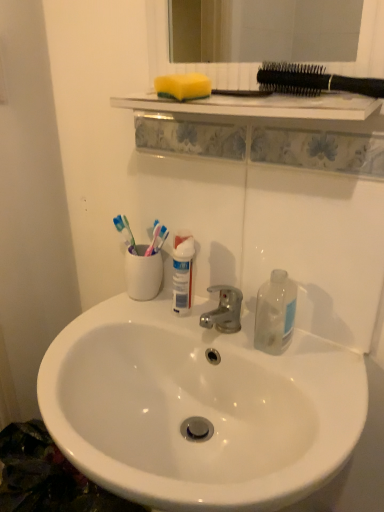
Question: Is yellow sponge at upper center to the right of white ceramic toothbrush holder at center from the viewer's perspective?

Choices:
 (A) yes
 (B) no

Answer: (A)

Question: Is white ceramic toothbrush holder at center at the back of yellow sponge at upper center?

Choices:
 (A) no
 (B) yes

Answer: (A)

Question: Is yellow sponge at upper center with white ceramic toothbrush holder at center?

Choices:
 (A) yes
 (B) no

Answer: (B)

Question: Does yellow sponge at upper center have a smaller size compared to white ceramic toothbrush holder at center?

Choices:
 (A) no
 (B) yes

Answer: (B)

Question: From the image's perspective, would you say yellow sponge at upper center is positioned over white ceramic toothbrush holder at center?

Choices:
 (A) no
 (B) yes

Answer: (B)

Question: Do you think white ceramic toothbrush holder at center is within white glossy sink at center, or outside of it?

Choices:
 (A) outside
 (B) inside

Answer: (A)

Question: Is white ceramic toothbrush holder at center in front of or behind white glossy sink at center in the image?

Choices:
 (A) behind
 (B) front

Answer: (A)

Question: From a real-world perspective, relative to white glossy sink at center, is white ceramic toothbrush holder at center vertically above or below?

Choices:
 (A) above
 (B) below

Answer: (A)

Question: Considering the positions of white ceramic toothbrush holder at center and white glossy sink at center in the image, is white ceramic toothbrush holder at center taller or shorter than white glossy sink at center?

Choices:
 (A) tall
 (B) short

Answer: (B)

Question: From a real-world perspective, is white ceramic toothbrush holder at center positioned above or below transparent plastic bottle at right?

Choices:
 (A) above
 (B) below

Answer: (A)

Question: Choose the correct answer: Is white ceramic toothbrush holder at center inside transparent plastic bottle at right or outside it?

Choices:
 (A) inside
 (B) outside

Answer: (B)

Question: Is point (145, 269) closer or farther from the camera than point (291, 318)?

Choices:
 (A) closer
 (B) farther

Answer: (B)

Question: In terms of size, does white ceramic toothbrush holder at center appear bigger or smaller than transparent plastic bottle at right?

Choices:
 (A) big
 (B) small

Answer: (B)

Question: Considering the positions of transparent plastic bottle at right and white glossy sink at center in the image, is transparent plastic bottle at right bigger or smaller than white glossy sink at center?

Choices:
 (A) big
 (B) small

Answer: (B)

Question: Is transparent plastic bottle at right inside the boundaries of white glossy sink at center, or outside?

Choices:
 (A) inside
 (B) outside

Answer: (B)